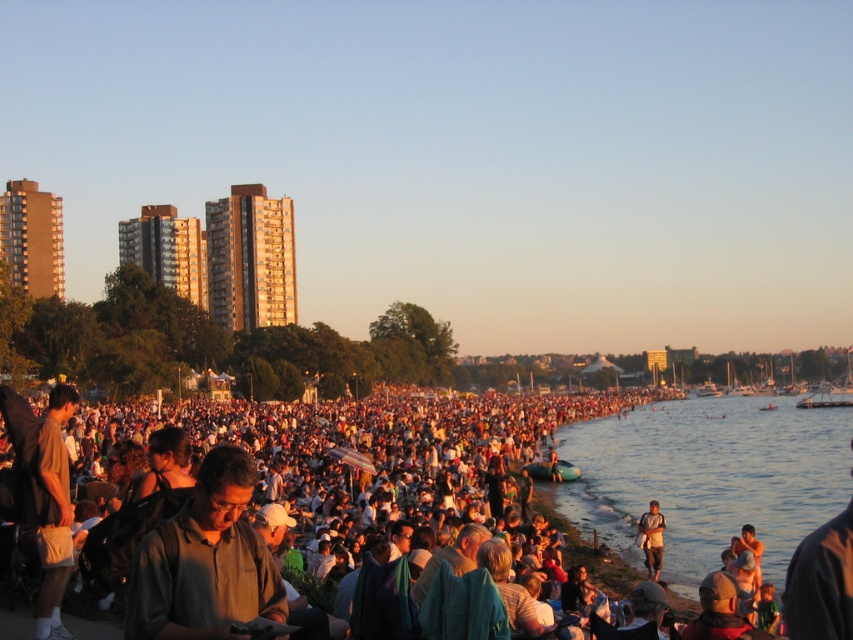
Question: Which object is positioned closest to the dark brown shirt at center?

Choices:
 (A) light brown fabric shirt at lower right
 (B) dark green shirt at center

Answer: (B)

Question: Is dark brown shirt at center smaller than dark green shirt at center?

Choices:
 (A) no
 (B) yes

Answer: (A)

Question: Which point appears closest to the camera in this image?

Choices:
 (A) (651, 532)
 (B) (300, 484)
 (C) (846, 496)
 (D) (244, 508)

Answer: (D)

Question: Does clear water at lower right have a lesser width compared to dark green shirt at center?

Choices:
 (A) yes
 (B) no

Answer: (B)

Question: Among these objects, which one is farthest from the camera?

Choices:
 (A) clear water at lower right
 (B) dark brown shirt at center
 (C) dark green shirt at center

Answer: (A)

Question: Is clear water at lower right bigger than dark green shirt at center?

Choices:
 (A) yes
 (B) no

Answer: (A)